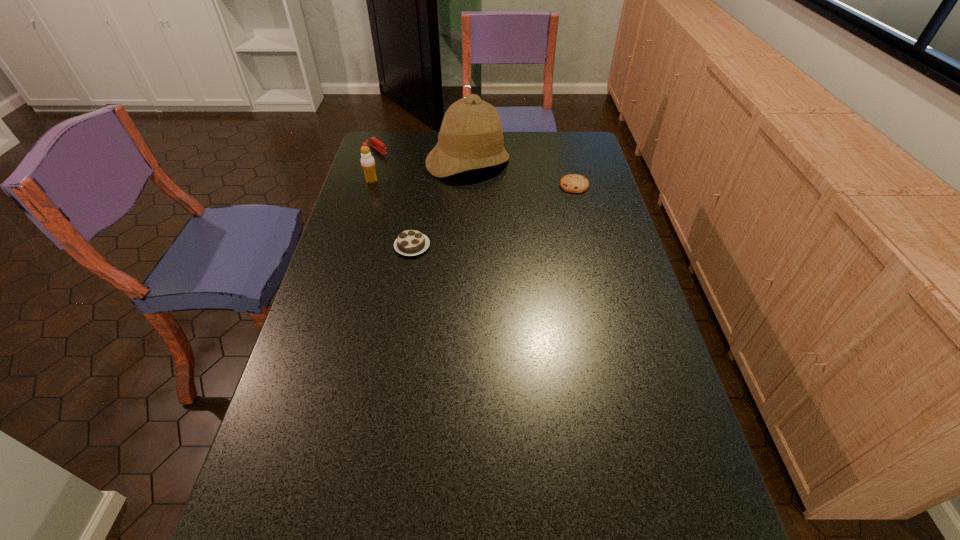
What are the coordinates of `vacant region that satisfies the following two spatial constraints: 1. on the front side of the stapler; 2. on the right side of the second tallest object` in the screenshot? It's located at (369, 180).

Locate an element on the screen. The height and width of the screenshot is (540, 960). blank area in the image that satisfies the following two spatial constraints: 1. on the front side of the icecream; 2. on the right side of the chocolate cake is located at coordinates (352, 246).